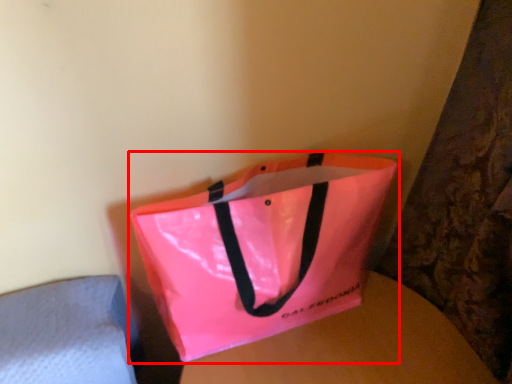
Question: From the image, what is the correct spatial relationship of handbag (annotated by the red box) in relation to round table?

Choices:
 (A) right
 (B) left

Answer: (B)